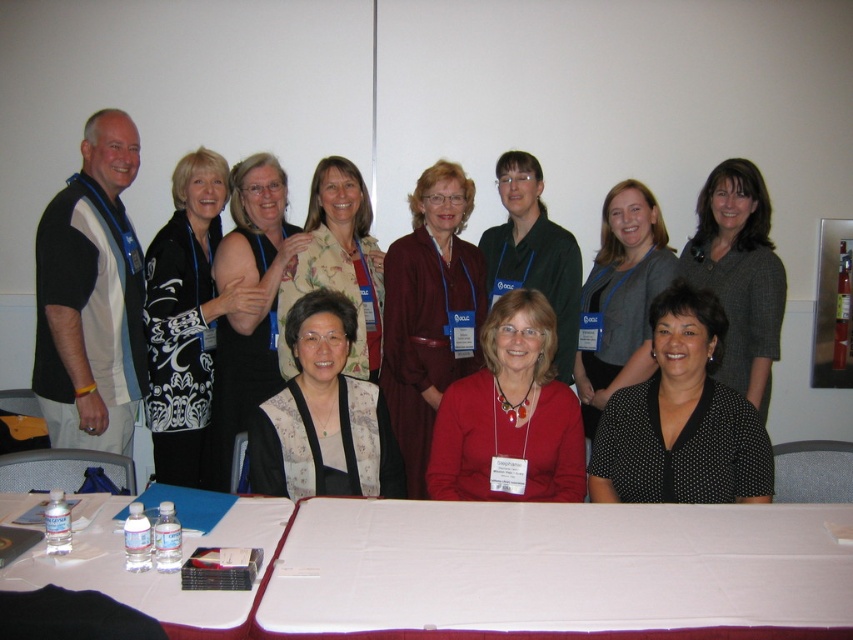
Question: Can you confirm if black dotted blouse at lower right is positioned above black dotted dress at lower right?

Choices:
 (A) no
 (B) yes

Answer: (B)

Question: Can you confirm if matte red sweater at center is positioned to the right of matte black dress at center?

Choices:
 (A) no
 (B) yes

Answer: (B)

Question: Among these points, which one is nearest to the camera?

Choices:
 (A) (714, 170)
 (B) (329, 432)

Answer: (B)

Question: Which point appears closest to the camera in this image?

Choices:
 (A) (258, 579)
 (B) (720, 275)
 (C) (338, 204)

Answer: (A)

Question: Which of the following is the closest to the observer?

Choices:
 (A) black printed fabric at upper left
 (B) black dotted dress at lower right
 (C) maroon wool coat at center

Answer: (A)

Question: Can you confirm if clear plastic water bottles at lower center is wider than floral silk blouse at center?

Choices:
 (A) yes
 (B) no

Answer: (A)